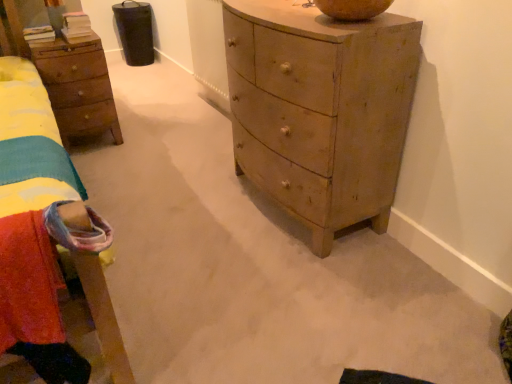
Question: Can you confirm if velvety red blanket at lower left is taller than light brown wooden chest of drawers at center?

Choices:
 (A) no
 (B) yes

Answer: (A)

Question: From the image's perspective, would you say velvety red blanket at lower left is positioned over light brown wooden chest of drawers at center?

Choices:
 (A) no
 (B) yes

Answer: (A)

Question: From a real-world perspective, is velvety red blanket at lower left below light brown wooden chest of drawers at center?

Choices:
 (A) yes
 (B) no

Answer: (B)

Question: Considering the relative sizes of velvety red blanket at lower left and light brown wooden chest of drawers at center in the image provided, is velvety red blanket at lower left shorter than light brown wooden chest of drawers at center?

Choices:
 (A) no
 (B) yes

Answer: (B)

Question: Is velvety red blanket at lower left to the right of light brown wooden chest of drawers at center from the viewer's perspective?

Choices:
 (A) yes
 (B) no

Answer: (B)

Question: Is velvety red blanket at lower left at the left side of light brown wooden chest of drawers at center?

Choices:
 (A) no
 (B) yes

Answer: (B)

Question: Does wooden nightstand at left have a smaller size compared to light brown wooden chest of drawers at center?

Choices:
 (A) yes
 (B) no

Answer: (A)

Question: Is wooden nightstand at left to the left of light brown wooden chest of drawers at center from the viewer's perspective?

Choices:
 (A) yes
 (B) no

Answer: (A)

Question: From a real-world perspective, is wooden nightstand at left located higher than light brown wooden chest of drawers at center?

Choices:
 (A) yes
 (B) no

Answer: (B)

Question: Can you confirm if wooden nightstand at left is thinner than light brown wooden chest of drawers at center?

Choices:
 (A) no
 (B) yes

Answer: (B)

Question: Does wooden nightstand at left come in front of light brown wooden chest of drawers at center?

Choices:
 (A) yes
 (B) no

Answer: (B)

Question: Can you confirm if wooden nightstand at left is taller than light brown wooden chest of drawers at center?

Choices:
 (A) yes
 (B) no

Answer: (B)

Question: Is light brown wooden chest of drawers at center wider than velvety red blanket at lower left?

Choices:
 (A) no
 (B) yes

Answer: (B)